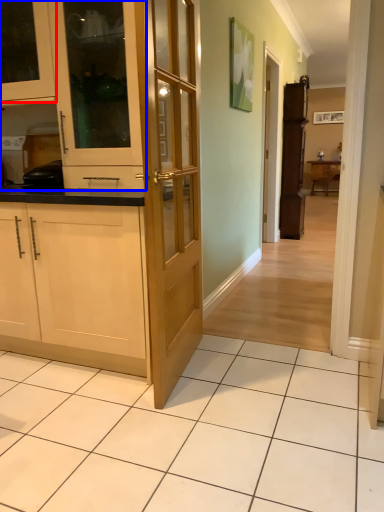
Question: Among these objects, which one is farthest to the camera, cabinetry (highlighted by a red box) or cabinetry (highlighted by a blue box)?

Choices:
 (A) cabinetry
 (B) cabinetry

Answer: (A)